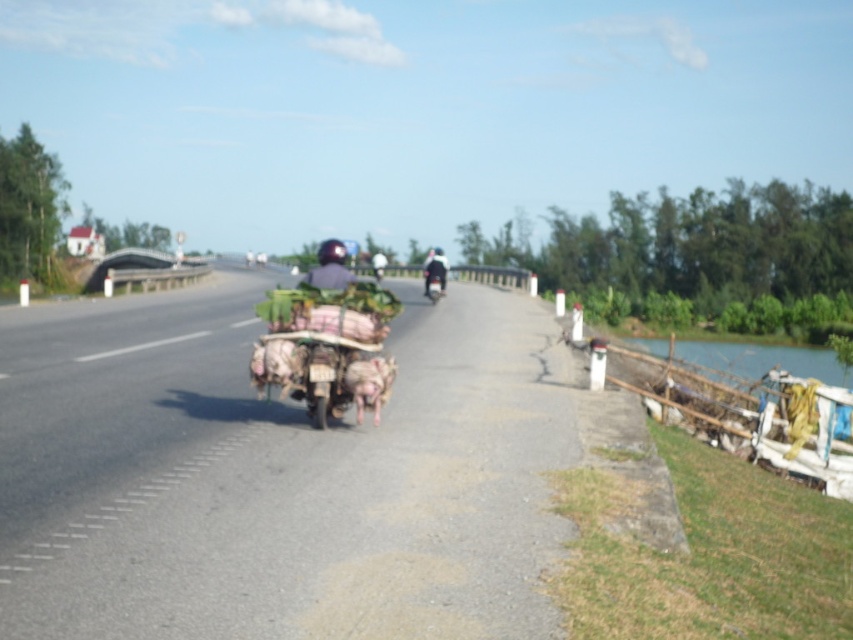
Question: Is the position of smooth asphalt road at center less distant than that of shiny black motorcycle at center?

Choices:
 (A) yes
 (B) no

Answer: (A)

Question: Can you confirm if smooth asphalt road at center is positioned to the right of shiny black motorcycle at center?

Choices:
 (A) no
 (B) yes

Answer: (A)

Question: Which object is the farthest from the fur-like pink piglet at center?

Choices:
 (A) rusty metal cart at center
 (B) metallic silver motorcycle at center
 (C) smooth asphalt road at center

Answer: (B)

Question: Which point appears farthest from the camera in this image?

Choices:
 (A) (433, 272)
 (B) (300, 292)
 (C) (434, 292)
 (D) (370, 371)

Answer: (C)

Question: Does fur-like pink piglet at center have a larger size compared to metallic silver motorcycle at center?

Choices:
 (A) no
 (B) yes

Answer: (A)

Question: Among these points, which one is farthest from the camera?

Choices:
 (A) (438, 296)
 (B) (434, 264)
 (C) (387, 376)

Answer: (A)